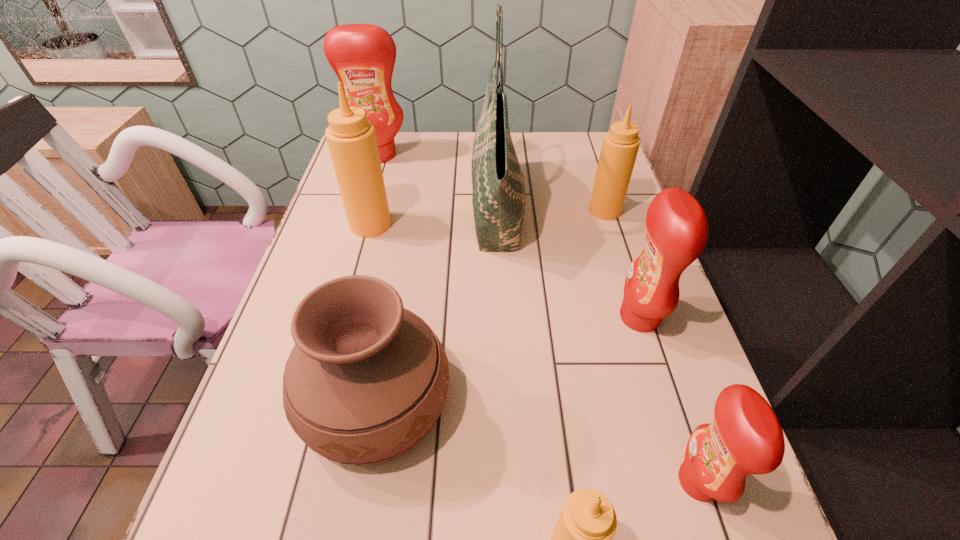
You are a GUI agent. You are given a task and a screenshot of the screen. Output one action in this format:
    pyautogui.click(x=<x>, y=<y>)
    Task: Click on the second nearest condiment
    The image size is (960, 540).
    Given the screenshot: What is the action you would take?
    (x=745, y=437)

The width and height of the screenshot is (960, 540). I want to click on free space located 0.060m on the left of the green tote bag, so click(450, 208).

The width and height of the screenshot is (960, 540). I want to click on vacant point located on the label side of the leftmost red condiment, so click(x=359, y=222).

At what (x,y) coordinates should I click in order to perform the action: click on free space located 0.330m on the right of the leftmost tan condiment. Please return your answer as a coordinate pair (x, y). The height and width of the screenshot is (540, 960). Looking at the image, I should click on (516, 225).

Locate an element on the screen. This screenshot has height=540, width=960. vacant position located on the back of the second biggest tan condiment is located at coordinates (584, 145).

Where is `vacant space located 0.060m on the label side of the third nearest condiment`? Image resolution: width=960 pixels, height=540 pixels. vacant space located 0.060m on the label side of the third nearest condiment is located at coordinates (589, 317).

Where is `free spot located on the label side of the third nearest condiment`? The image size is (960, 540). free spot located on the label side of the third nearest condiment is located at coordinates (506, 317).

The width and height of the screenshot is (960, 540). Find the location of `free space located on the label side of the third nearest condiment`. free space located on the label side of the third nearest condiment is located at coordinates (455, 317).

The width and height of the screenshot is (960, 540). Identify the location of vacant position located on the right of the urn. (668, 402).

Where is `vacant space located 0.070m on the label side of the second nearest condiment`? The image size is (960, 540). vacant space located 0.070m on the label side of the second nearest condiment is located at coordinates (633, 481).